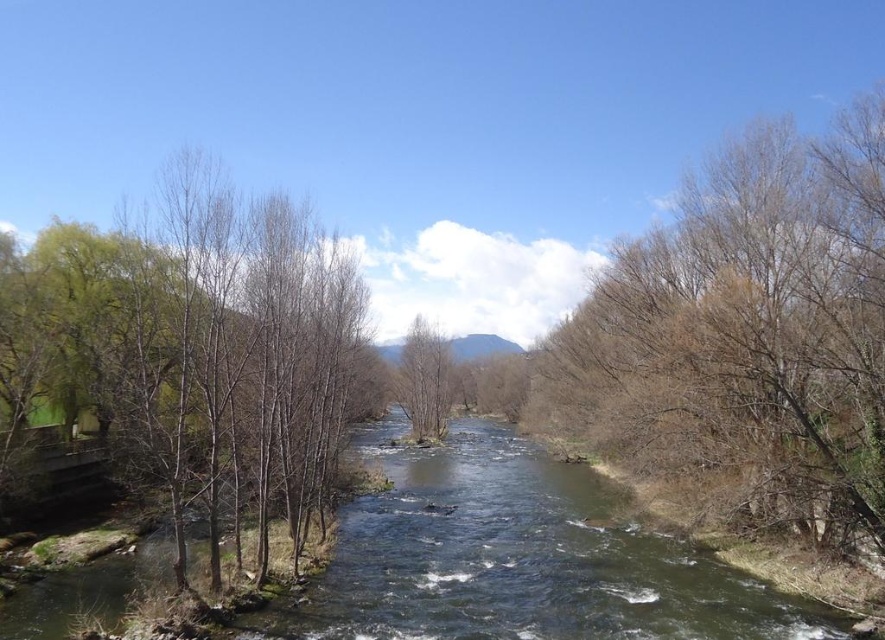
Which is behind, point (597, 280) or point (124, 339)?

The point (597, 280) is behind.

Does point (609, 349) come closer to viewer compared to point (218, 528)?

No, it is not.

Between point (759, 356) and point (27, 330), which one is positioned in front?

Point (759, 356)

Image resolution: width=885 pixels, height=640 pixels. I want to click on bare branches at right, so click(745, 337).

Is green leafy tree at left closer to the viewer compared to bare wood tree at center?

Yes, green leafy tree at left is in front of bare wood tree at center.

Between green leafy tree at left and bare wood tree at center, which one is positioned lower?

bare wood tree at center is below.

Does point (145, 381) lie behind point (437, 435)?

That is False.

Identify the location of green leafy tree at left. This screenshot has height=640, width=885. (198, 358).

Looking at this image, who is lower down, bare branches at right or bare wood tree at center?

Positioned lower is bare wood tree at center.

Is bare branches at right to the right of bare wood tree at center from the viewer's perspective?

Correct, you'll find bare branches at right to the right of bare wood tree at center.

Which is behind, point (818, 433) or point (399, 384)?

Positioned behind is point (399, 384).

This screenshot has width=885, height=640. I want to click on bare branches at right, so click(745, 337).